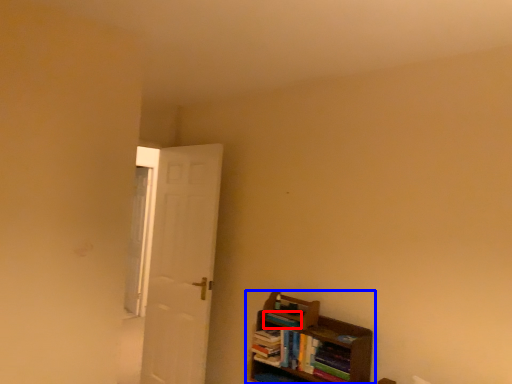
Question: Which of the following is the closest to the observer, book (highlighted by a red box) or shelf (highlighted by a blue box)?

Choices:
 (A) book
 (B) shelf

Answer: (B)